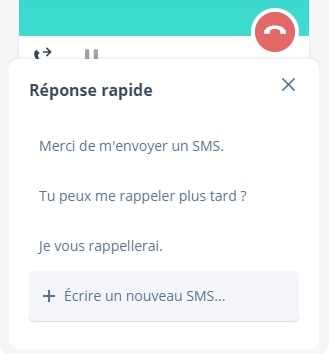
Locate an element on the screen. The width and height of the screenshot is (329, 354). exit button is located at coordinates (285, 81).